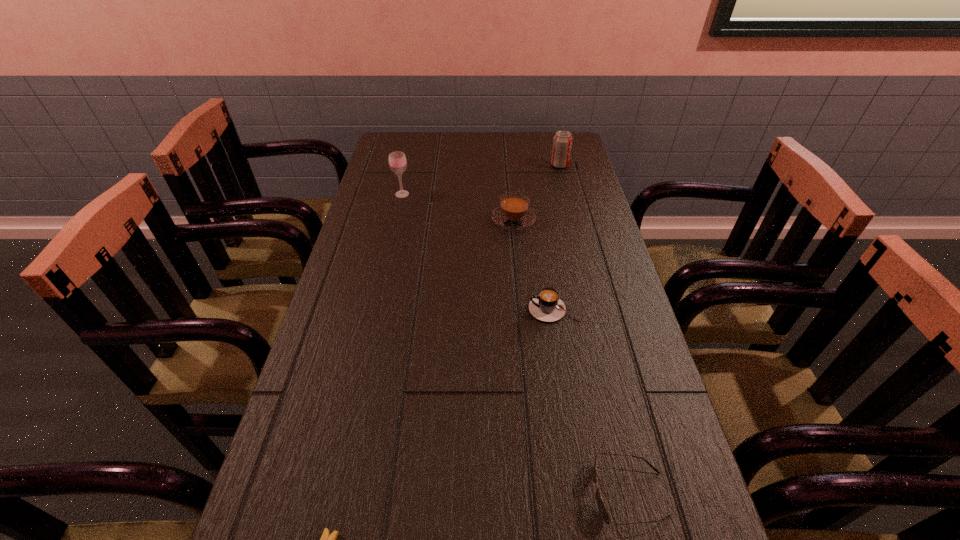
Find the location of a particular element. blank region between the fourth shortest object and the farthest object is located at coordinates (537, 192).

Where is `free spot between the tallest object and the fourth nearest object`? This screenshot has height=540, width=960. free spot between the tallest object and the fourth nearest object is located at coordinates (458, 207).

Locate an element on the screen. This screenshot has width=960, height=540. free space between the third nearest object and the second shortest object is located at coordinates (591, 401).

Identify the location of vacant space in between the sunglasses and the fifth shortest object. (594, 329).

Locate an element on the screen. The width and height of the screenshot is (960, 540). empty space that is in between the second farthest object and the fourth farthest object is located at coordinates click(x=478, y=252).

Find the location of a particular element. The image size is (960, 540). the closest object to the second shortest object is located at coordinates (547, 306).

I want to click on object that is the fourth closest to the tallest object, so click(x=602, y=509).

The height and width of the screenshot is (540, 960). I want to click on vacant position in the image that satisfies the following two spatial constraints: 1. on the front side of the farthest object; 2. on the front-facing side of the sunglasses, so click(x=643, y=494).